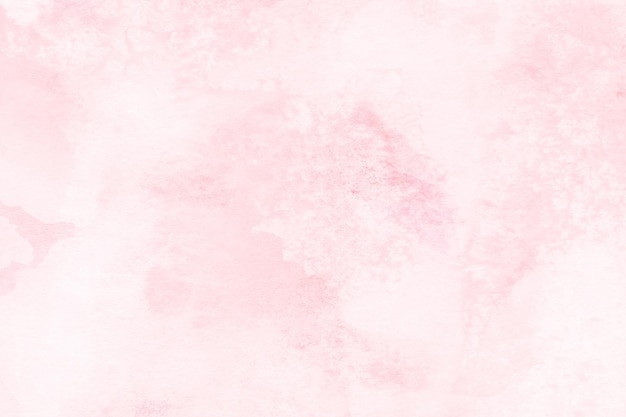
This screenshot has height=417, width=626. I want to click on bottom right corner of surface, so click(x=623, y=413).